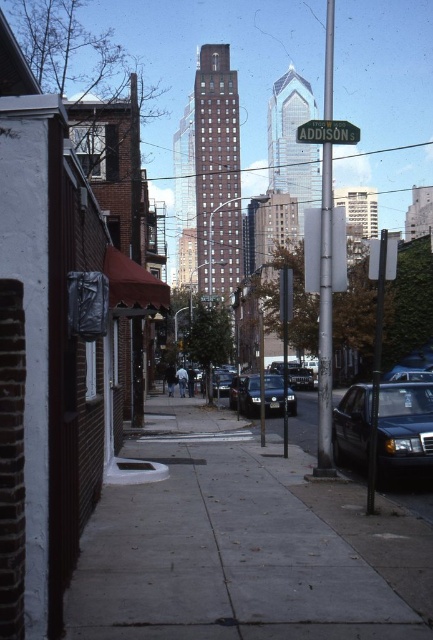
Question: Which object appears closest to the camera in this image?

Choices:
 (A) green metallic street sign at center
 (B) gray concrete sidewalk at center
 (C) silver metallic pole at center

Answer: (B)

Question: Is the position of shiny black sedan at lower right more distant than that of silver metallic pole at center?

Choices:
 (A) yes
 (B) no

Answer: (B)

Question: Does silver metallic pole at center appear on the left side of green metallic street sign at center?

Choices:
 (A) yes
 (B) no

Answer: (B)

Question: Estimate the real-world distances between objects in this image. Which object is farther from the silver metallic pole at center?

Choices:
 (A) green metallic street sign at center
 (B) shiny black sedan at lower right
 (C) gray concrete sidewalk at center
 (D) shiny black sedan at center

Answer: (B)

Question: Which point appears closest to the camera in this image?

Choices:
 (A) (329, 328)
 (B) (174, 484)

Answer: (B)

Question: From the image, what is the correct spatial relationship of shiny black sedan at lower right in relation to shiny black sedan at center?

Choices:
 (A) below
 (B) above

Answer: (B)